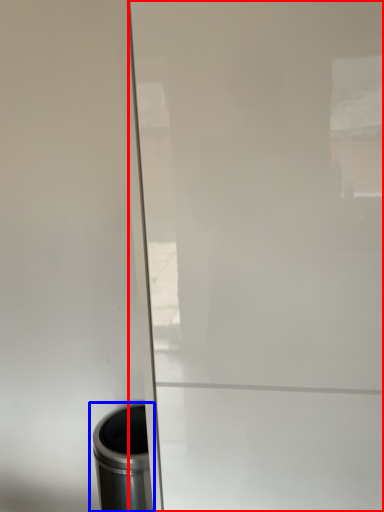
Question: Which point is further to the camera, screen door (highlighted by a red box) or waste container (highlighted by a blue box)?

Choices:
 (A) screen door
 (B) waste container

Answer: (B)